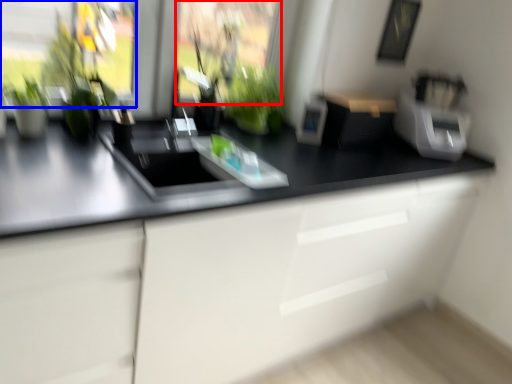
Question: Which object is closer to the camera taking this photo, window screen (highlighted by a red box) or window screen (highlighted by a blue box)?

Choices:
 (A) window screen
 (B) window screen

Answer: (B)